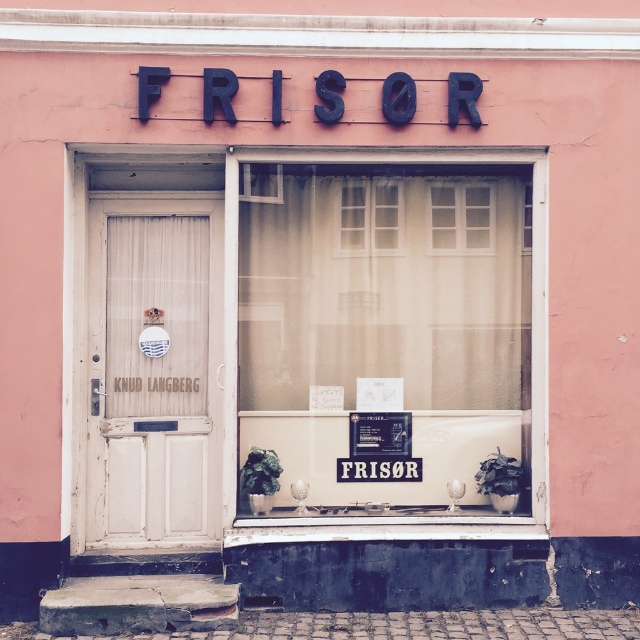
You are a customer arriving at the FRISOR hair salon. You see the translucent fabric at center and the white wooden door at left. Which object is covering the door?

The translucent fabric at center is positioned over the white wooden door at left, so the translucent fabric at center is covering the door.

You are a delivery person holding a package addressed to Knud Langberg. You arrive at the FRISOR storefront and see the white wooden door at left and the white paper at center. Which object should you interact with to deliver the package?

You should interact with the white wooden door at left because it has a mail slot, which is typically used for package delivery. The white paper at center is likely a sign or advertisement and not meant for receiving packages.